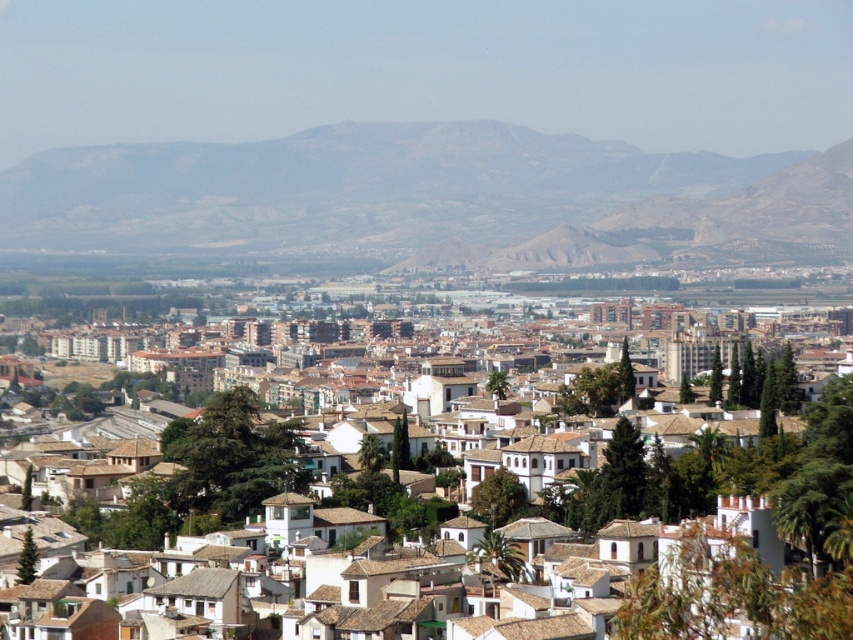
You are an urban planner assessing the city layout. You need to determine if the white clay buildings at center can be expanded horizontally without encroaching on the rugged brown hillside at center. Based on their current widths, is this feasible?

The white clay buildings at center are narrower than the rugged brown hillside at center, so there is potential to expand the white clay buildings at center horizontally without immediately encroaching on the rugged brown hillside at center. However, careful planning would still be necessary to ensure compliance with zoning laws and environmental regulations.

You are an urban planner analyzing this cityscape. You need to determine which of the two elements, the white clay buildings at center or the rugged brown hillside at center, occupies a greater area in the central part of the image. Based on the scene description, which one is larger?

The white clay buildings at center is larger in size than the rugged brown hillside at center, so the white clay buildings at center occupies a greater area in the central part of the image.

You are an urban planner analyzing this city layout. You need to determine the elevation relationship between the gray rocky mountain at upper center and the white clay buildings at center. Based on the image, which one is higher in elevation?

The gray rocky mountain at upper center is above the white clay buildings at center, so it has a higher elevation.